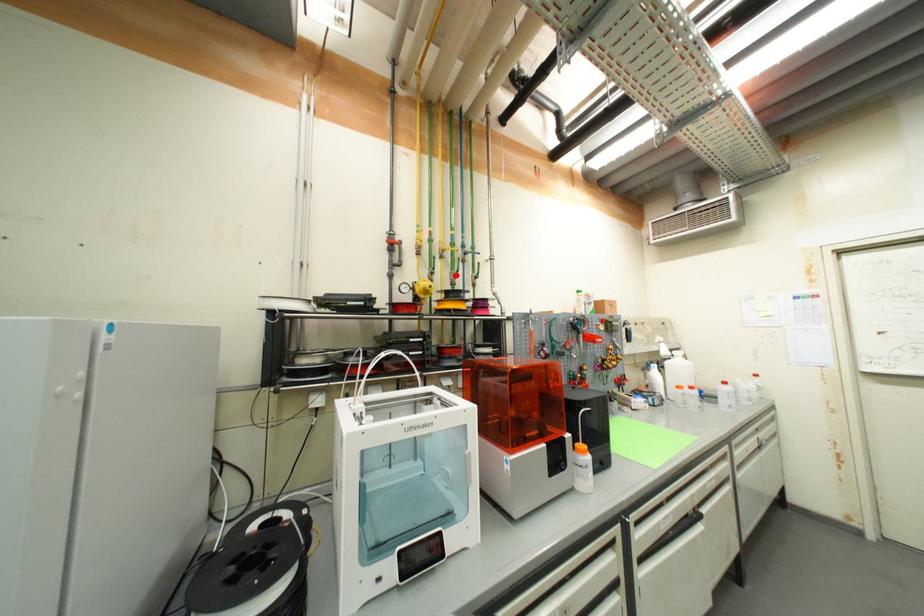
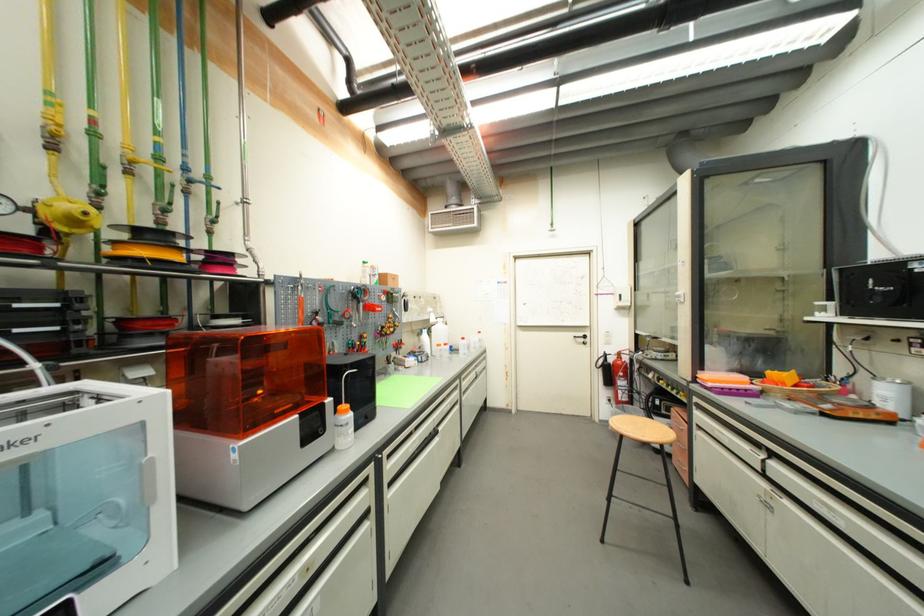
The point at the highlighted location is marked in the first image. Where is the corresponding point in the second image?

(160, 207)